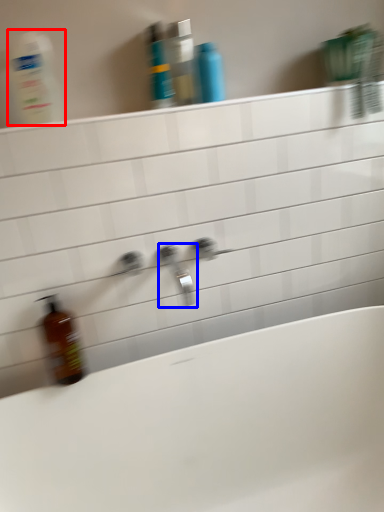
Question: Which of the following is the farthest to the observer, cleaning product (highlighted by a red box) or tap (highlighted by a blue box)?

Choices:
 (A) cleaning product
 (B) tap

Answer: (B)